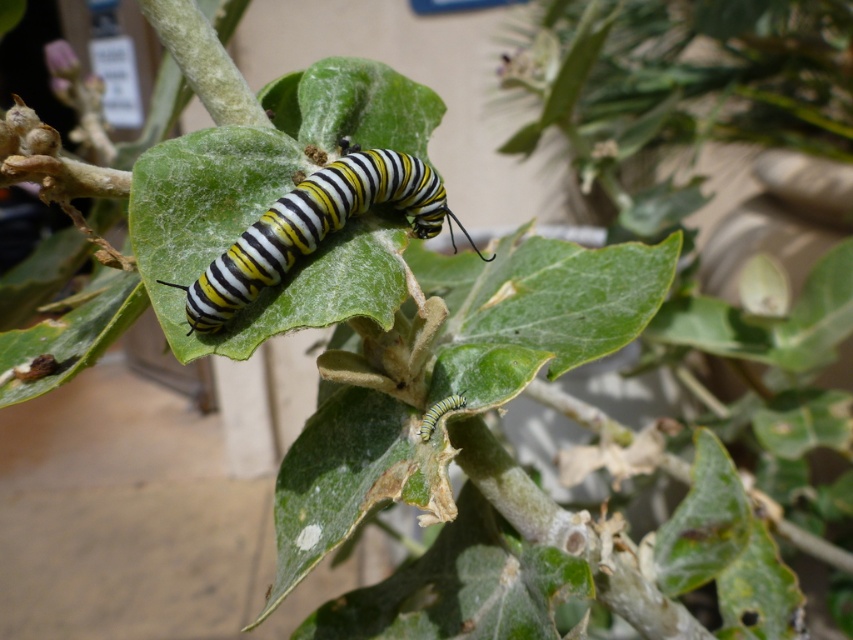
Consider the image. You are a photographer trying to capture a detailed image of the caterpillar. You notice two points marked on your screen at coordinates point (202, 332) and point (434, 412). Which point should you focus on to ensure the caterpillar is in sharp focus?

Point (202, 332) is closer to the camera than point (434, 412), so focusing on point (202, 332) will ensure the caterpillar is in sharp focus.